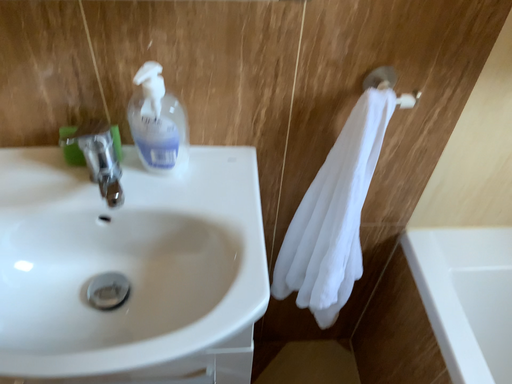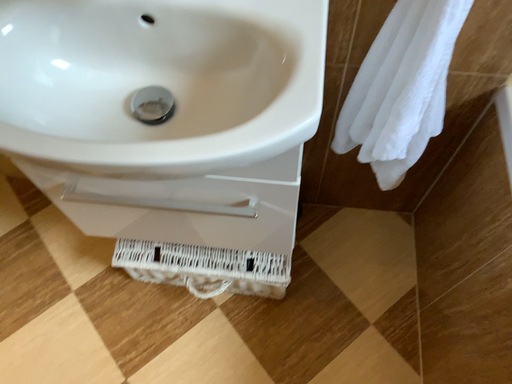
Question: Which way did the camera rotate in the video?

Choices:
 (A) rotated upward
 (B) rotated downward

Answer: (B)